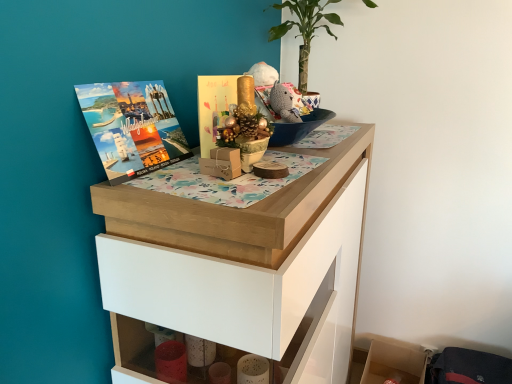
Find the location of `free space in front of gold paper card at center, the 1th book cover viewed from the right`. free space in front of gold paper card at center, the 1th book cover viewed from the right is located at coordinates (192, 177).